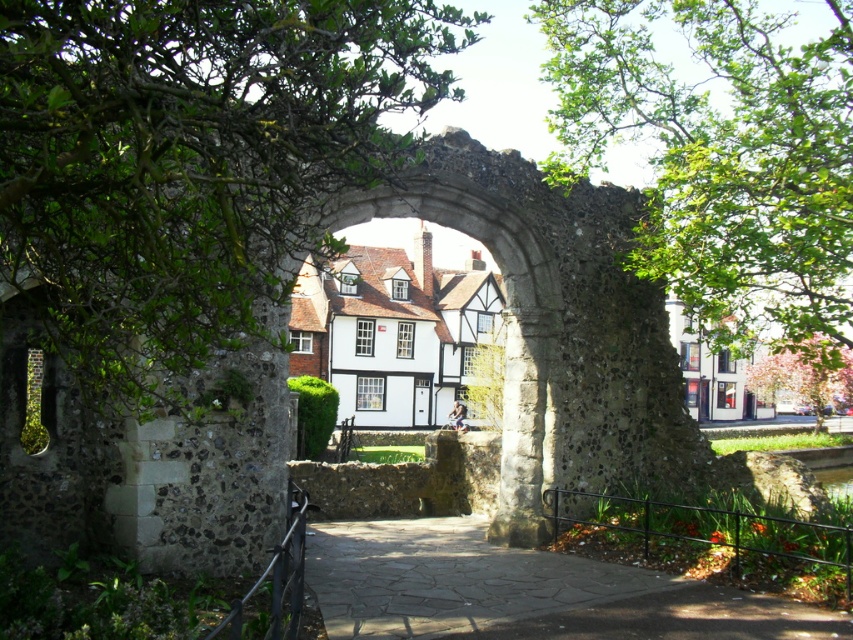
Can you confirm if green leafy tree at center is positioned to the right of pink blossoming tree at right?

No, green leafy tree at center is not to the right of pink blossoming tree at right.

The image size is (853, 640). Identify the location of green leafy tree at center. (190, 157).

Does point (94, 316) lie behind point (793, 340)?

No, (94, 316) is in front of (793, 340).

Where is `green leafy tree at center`? The height and width of the screenshot is (640, 853). green leafy tree at center is located at coordinates (190, 157).

Between green leafy tree at center and green leafy tree at upper right, which one is positioned lower?

green leafy tree at center

Between point (376, 132) and point (717, 259), which one is positioned in front?

Point (376, 132) is more forward.

Locate an element on the screen. green leafy tree at center is located at coordinates (x=190, y=157).

Consider the image. Can you confirm if green leafy tree at center is positioned above paved stone path at center?

Yes.

Is green leafy tree at center positioned in front of paved stone path at center?

That is True.

Between point (323, 88) and point (306, 564), which one is positioned behind?

The point (306, 564) is behind.

Locate an element on the screen. The image size is (853, 640). green leafy tree at center is located at coordinates (190, 157).